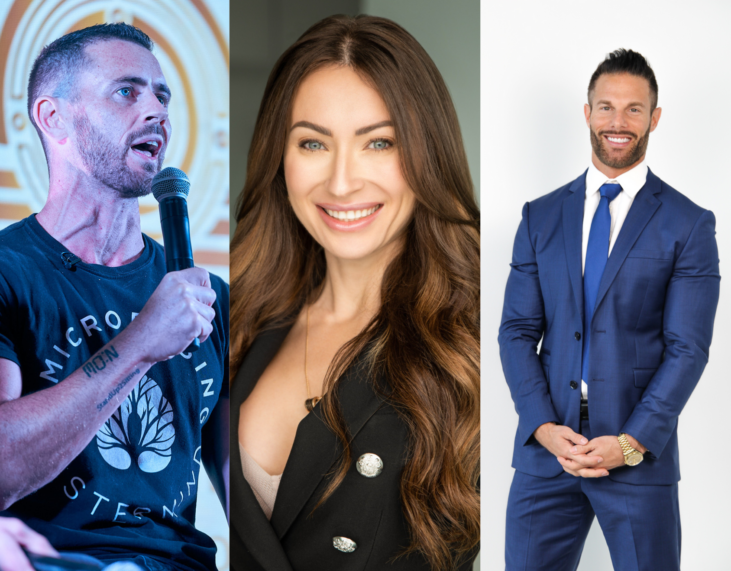
This screenshot has height=571, width=731. Find the location of `wall`. wall is located at coordinates (441, 18), (261, 29).